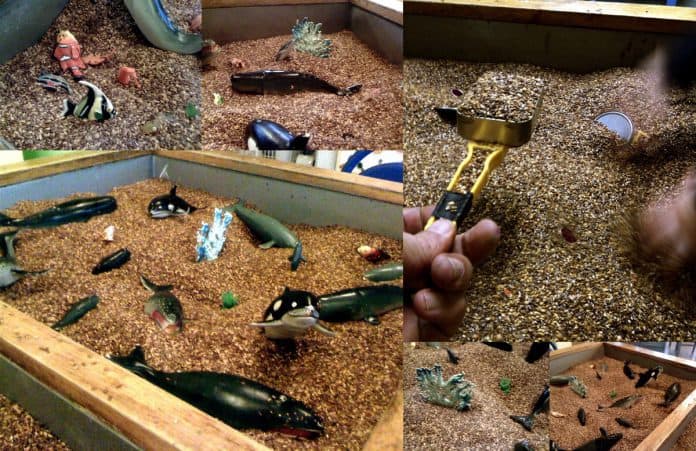
This screenshot has width=696, height=451. I want to click on clown fish toy, so click(63, 48).